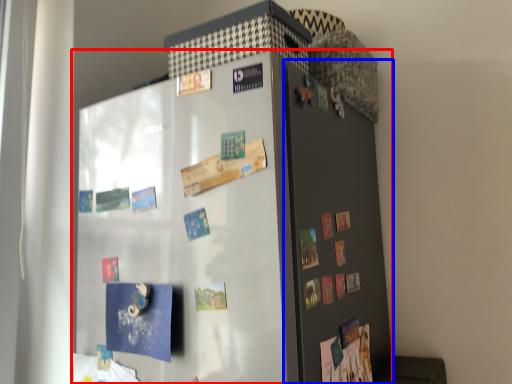
Question: Among these objects, which one is nearest to the camera, refrigerator (highlighted by a red box) or door (highlighted by a blue box)?

Choices:
 (A) refrigerator
 (B) door

Answer: (A)